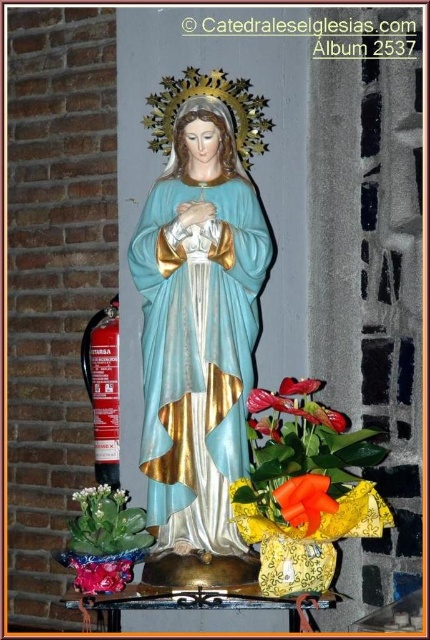
You are an interior designer planning to place a new decorative item between the matte green succulent at lower left and the matte orange anthurium at center. Considering their sizes, which of the two plants should you use as a reference for spacing to ensure the new item fits appropriately?

The matte green succulent at lower left has a larger width than the matte orange anthurium at center. Therefore, you should use the matte green succulent at lower left as the reference to ensure the new item accommodates the larger size.

Based on the scene description, where is the matte orange flower at center located in relation to the statue of the Virgin Mary?

The matte orange flower at center is located at point (280, 404) in the image, which is at the center of the scene.

You are standing in a room with the statue of the Virgin Mary. You see a matte green succulent at lower left and a matte orange anthurium at center. Which one is positioned more to the left side of the room?

The matte green succulent at lower left is positioned more to the left side of the room than the matte orange anthurium at center.